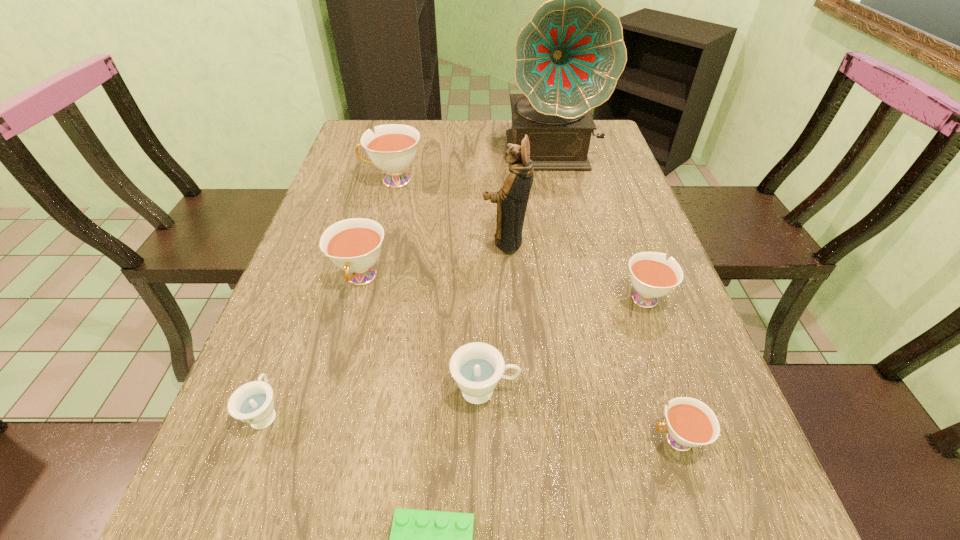
Image resolution: width=960 pixels, height=540 pixels. I want to click on record player that is at the right edge, so click(569, 56).

Image resolution: width=960 pixels, height=540 pixels. What are the coordinates of `object positioned at the far right corner` in the screenshot? It's located at (569, 56).

The height and width of the screenshot is (540, 960). I want to click on vacant space at the far edge, so click(x=481, y=151).

Locate an element on the screen. The width and height of the screenshot is (960, 540). vacant space at the left edge of the desktop is located at coordinates (268, 339).

I want to click on vacant space at the right edge, so click(639, 420).

This screenshot has height=540, width=960. I want to click on free space between the figurine and the third biggest white teacup, so click(x=574, y=269).

Identify the location of free space between the figurine and the right blue teacup. (495, 316).

The height and width of the screenshot is (540, 960). I want to click on free area in between the eighth shortest object and the nearest white teacup, so click(x=590, y=341).

Where is `free spot between the second biggest white teacup and the eighth shortest object`? This screenshot has width=960, height=540. free spot between the second biggest white teacup and the eighth shortest object is located at coordinates (433, 260).

The width and height of the screenshot is (960, 540). I want to click on free spot between the record player and the smaller blue teacup, so click(x=409, y=282).